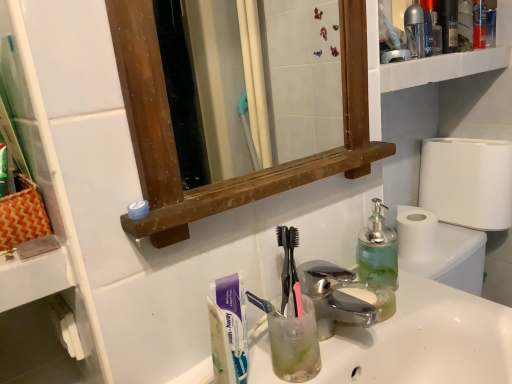
Where is `free point in front of green translucent soap dispenser at right, the 1th bottle when ordered from front to back`? The width and height of the screenshot is (512, 384). free point in front of green translucent soap dispenser at right, the 1th bottle when ordered from front to back is located at coordinates (412, 317).